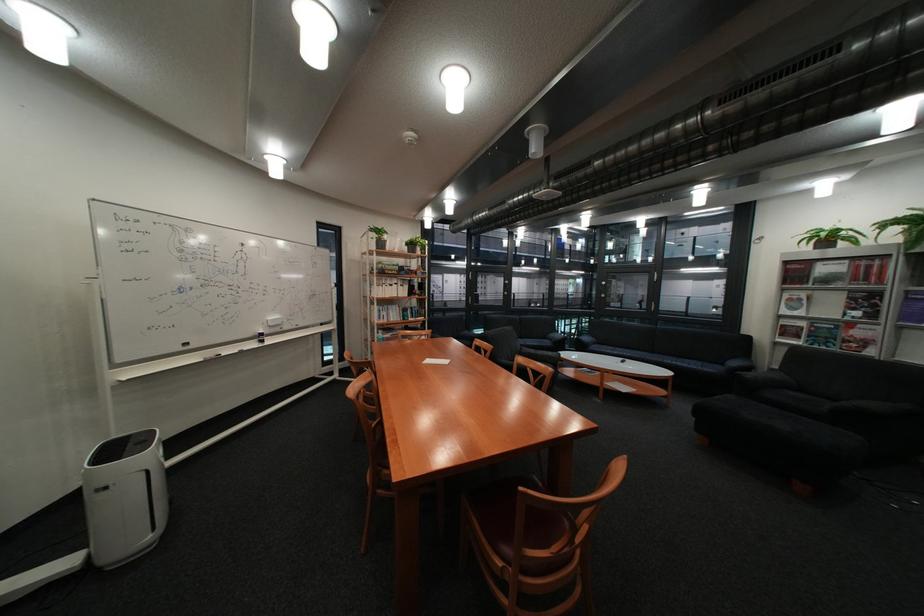
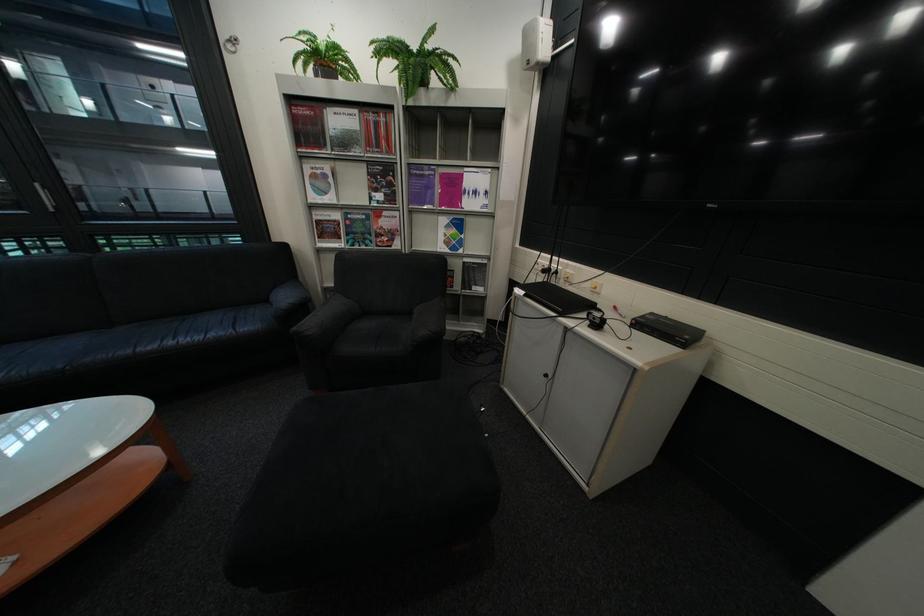
Find the pixel in the second image that matches [700,365] in the first image.

(213, 338)